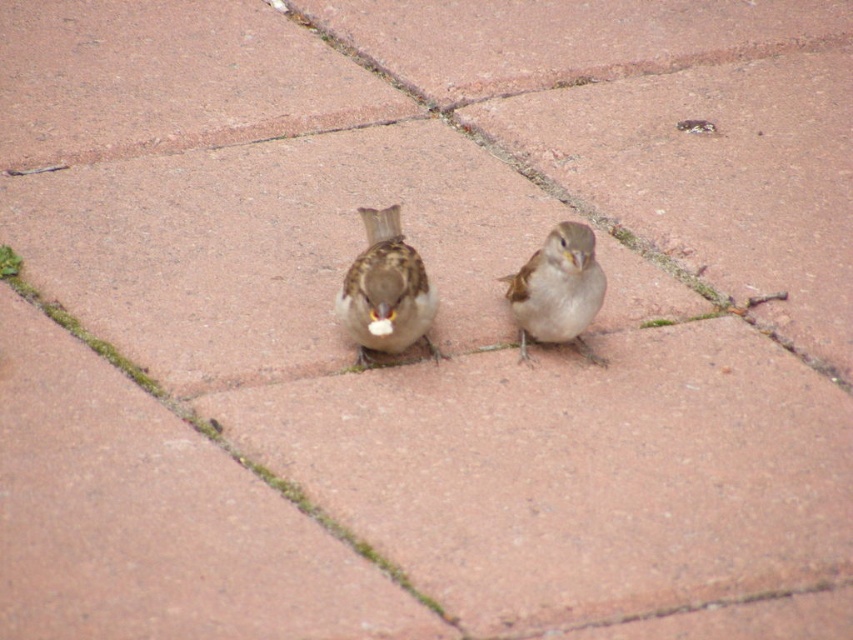
Looking at this image, you are a birdwatcher observing two sparrows on a brick pavement. You notice the brown matte sparrow at center and the brown feathered sparrow at center. Which of these two birds is smaller in size?

The brown matte sparrow at center is smaller in size compared to the brown feathered sparrow at center according to the description.

You are a photographer trying to capture the brown matte sparrow at center in the image. Based on the coordinates provided, where should you aim your camera to ensure the bird is centered in the frame?

The brown matte sparrow at center is located at coordinates point (386,291), so you should aim your camera at that point to center it in the frame.